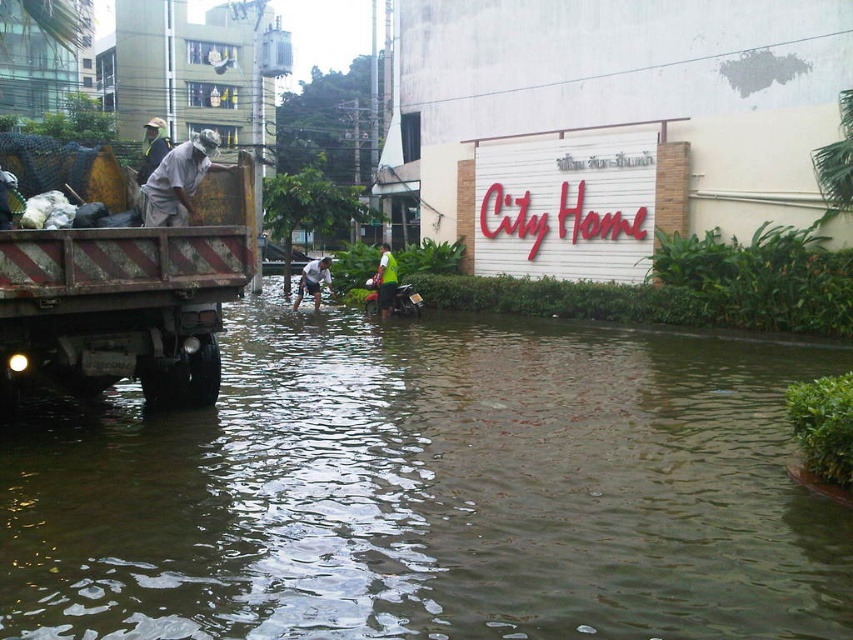
Between point (381, 280) and point (312, 266), which one is positioned in front?

Point (381, 280)

Is green reflective vest at center to the right of white fabric shirt at center from the viewer's perspective?

Indeed, green reflective vest at center is positioned on the right side of white fabric shirt at center.

Based on the photo, who is more distant from viewer, (376, 301) or (321, 266)?

Positioned behind is point (321, 266).

The image size is (853, 640). Identify the location of green reflective vest at center. click(386, 280).

Does brown murky water at lower center have a smaller size compared to green reflective vest at center?

Actually, brown murky water at lower center might be larger than green reflective vest at center.

Does point (604, 554) come closer to viewer compared to point (386, 250)?

Yes, it is in front of point (386, 250).

Between point (717, 355) and point (389, 266), which one is positioned behind?

The point (389, 266) is more distant.

Identify the location of brown murky water at lower center. The width and height of the screenshot is (853, 640). (430, 490).

Can you confirm if rusty metal truck at left is positioned below white fabric shirt at center?

Yes, rusty metal truck at left is below white fabric shirt at center.

Between point (169, 282) and point (303, 278), which one is positioned behind?

The point (303, 278) is more distant.

This screenshot has width=853, height=640. Find the location of `rusty metal truck at left`. rusty metal truck at left is located at coordinates (126, 300).